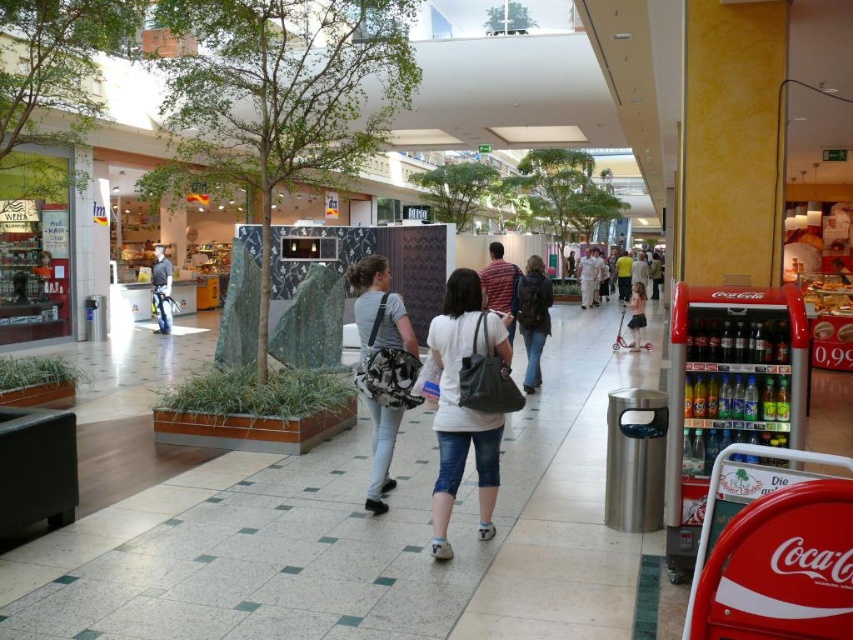
You are a delivery person carrying a white matte backpack at center and need to place it on the white tile pavement at center. Is there enough space between them for you to do so?

The white tile pavement at center and white matte backpack at center are 1.05 meters apart, so there is sufficient space for the delivery person to place the backpack on the pavement.